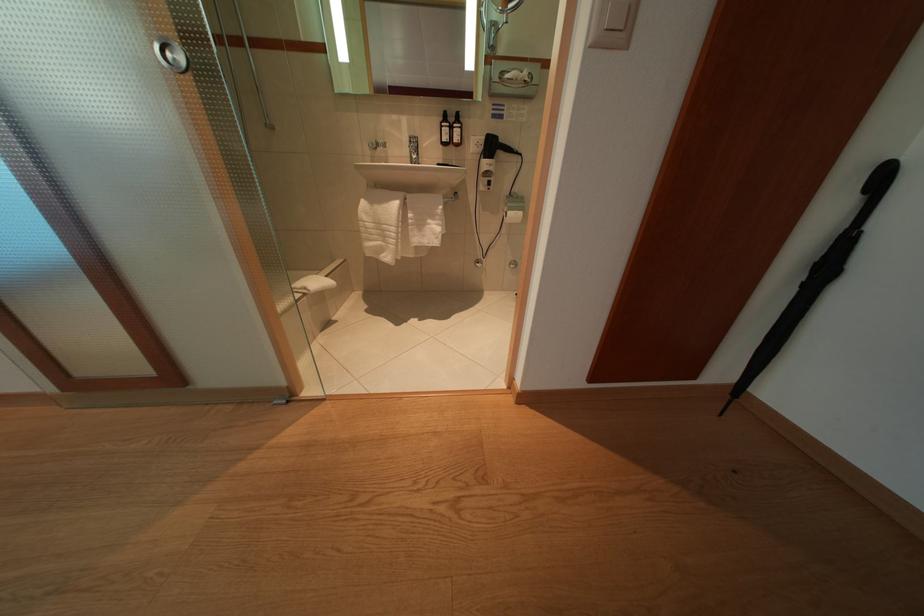
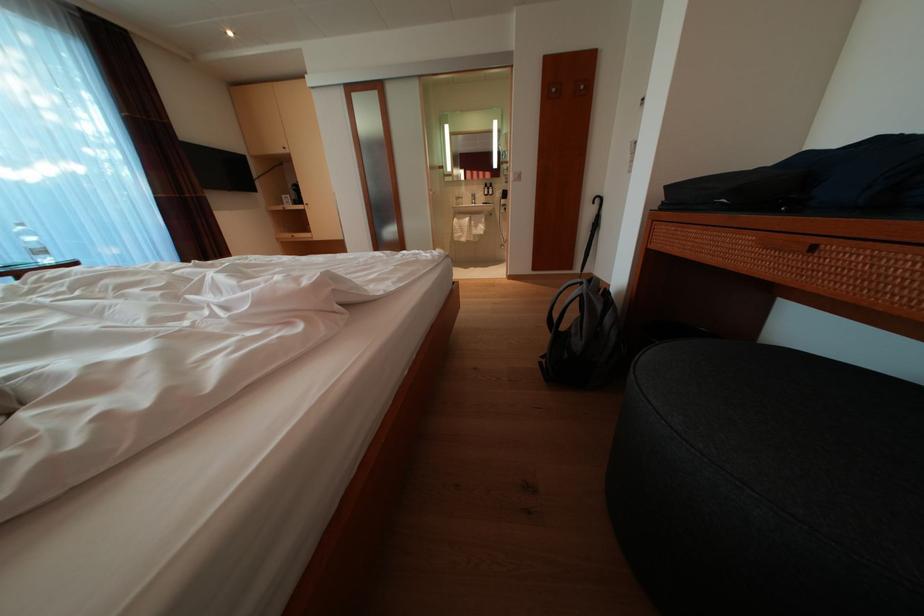
Question: Which direction would the cameraman need to move to produce the second image? Reply with the corresponding letter.

Choices:
 (A) Left
 (B) Right
 (C) Forward
 (D) Backward

Answer: (D)